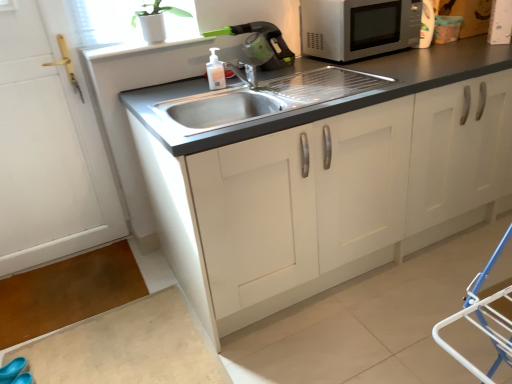
Question: Is satin silver microwave at upper right bigger than white matte cabinet at center?

Choices:
 (A) yes
 (B) no

Answer: (B)

Question: Is satin silver microwave at upper right completely or partially outside of white matte cabinet at center?

Choices:
 (A) yes
 (B) no

Answer: (A)

Question: From the image's perspective, is satin silver microwave at upper right located above white matte cabinet at center?

Choices:
 (A) yes
 (B) no

Answer: (A)

Question: Does satin silver microwave at upper right have a greater width compared to white matte cabinet at center?

Choices:
 (A) yes
 (B) no

Answer: (B)

Question: From the image's perspective, is satin silver microwave at upper right located beneath white matte cabinet at center?

Choices:
 (A) yes
 (B) no

Answer: (B)

Question: Visually, is white plastic container at upper right, acting as the first appliance starting from the right, positioned to the left or to the right of stainless steel sink at center?

Choices:
 (A) right
 (B) left

Answer: (A)

Question: Looking at the image, does white plastic container at upper right, acting as the second appliance starting from the left, seem bigger or smaller compared to stainless steel sink at center?

Choices:
 (A) small
 (B) big

Answer: (A)

Question: From the image's perspective, is white plastic container at upper right, acting as the first appliance starting from the right, located above or below stainless steel sink at center?

Choices:
 (A) below
 (B) above

Answer: (B)

Question: Is point (496, 39) positioned closer to the camera than point (373, 77)?

Choices:
 (A) closer
 (B) farther

Answer: (B)

Question: From the image's perspective, is white plastic container at upper right, acting as the second appliance starting from the left, above or below translucent plastic soap dispenser at sink?

Choices:
 (A) above
 (B) below

Answer: (A)

Question: Is white plastic container at upper right, acting as the second appliance starting from the left, in front of or behind translucent plastic soap dispenser at sink in the image?

Choices:
 (A) front
 (B) behind

Answer: (B)

Question: Considering the positions of white plastic container at upper right, acting as the first appliance starting from the right, and translucent plastic soap dispenser at sink in the image, is white plastic container at upper right, acting as the first appliance starting from the right, wider or thinner than translucent plastic soap dispenser at sink?

Choices:
 (A) wide
 (B) thin

Answer: (A)

Question: From a real-world perspective, relative to translucent plastic soap dispenser at sink, is white plastic container at upper right, acting as the second appliance starting from the left, vertically above or below?

Choices:
 (A) above
 (B) below

Answer: (A)

Question: Considering the positions of point (22, 359) and point (278, 33), is point (22, 359) closer or farther from the camera than point (278, 33)?

Choices:
 (A) farther
 (B) closer

Answer: (B)

Question: From a real-world perspective, is blue rubber shoe at lower left physically located above or below green plastic kettle at upper center, positioned as the 2th appliance in right-to-left order?

Choices:
 (A) below
 (B) above

Answer: (A)